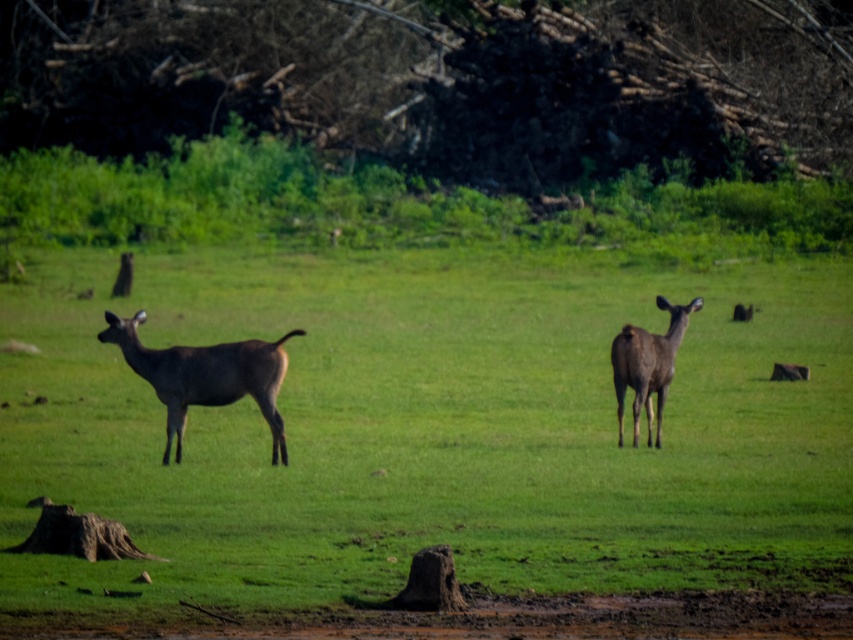
What do you see at coordinates (432, 428) in the screenshot?
I see `brown fur deer at center` at bounding box center [432, 428].

How far apart are brown fur deer at center and brown matte deer at center?

brown fur deer at center is 6.25 meters away from brown matte deer at center.

This screenshot has width=853, height=640. Describe the element at coordinates (432, 428) in the screenshot. I see `brown fur deer at center` at that location.

The width and height of the screenshot is (853, 640). In order to click on brown fur deer at center in this screenshot , I will do (x=432, y=428).

Is shiny brown deer at center above brown matte deer at center?

No, shiny brown deer at center is not above brown matte deer at center.

Which of these two, shiny brown deer at center or brown matte deer at center, stands shorter?

With less height is shiny brown deer at center.

Locate an element on the screen. shiny brown deer at center is located at coordinates (206, 376).

I want to click on shiny brown deer at center, so click(206, 376).

Can you confirm if brown fur deer at center is positioned below shiny brown deer at center?

Actually, brown fur deer at center is above shiny brown deer at center.

Is brown fur deer at center positioned behind shiny brown deer at center?

No.

What are the coordinates of `brown fur deer at center` in the screenshot? It's located at (432, 428).